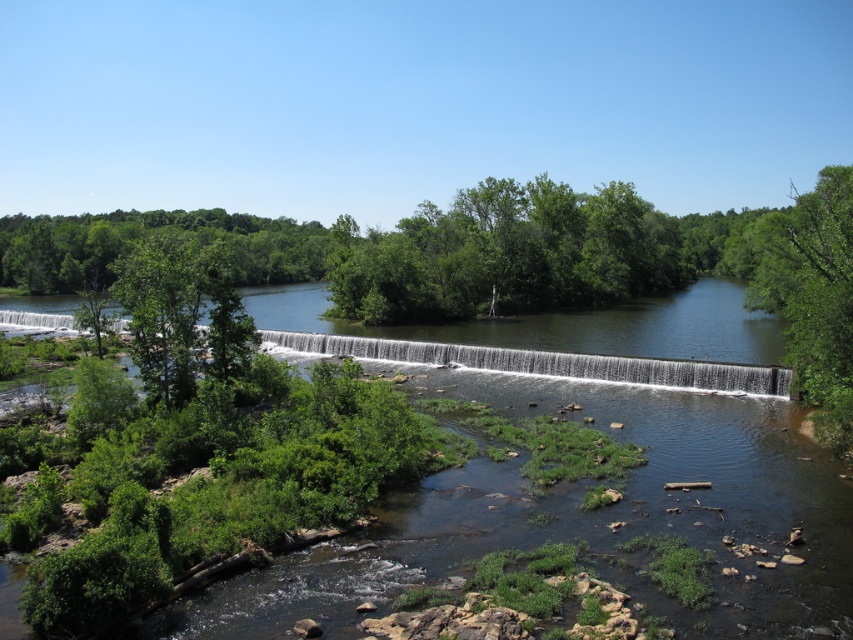
Is green leafy trees at upper left behind smooth concrete dam at center?

No, green leafy trees at upper left is in front of smooth concrete dam at center.

Which is above, green leafy trees at upper left or smooth concrete dam at center?

green leafy trees at upper left is above.

In order to click on green leafy trees at upper left in this screenshot , I will do `click(146, 234)`.

Is the position of green leafy tree at right more distant than that of smooth concrete dam at center?

No, green leafy tree at right is in front of smooth concrete dam at center.

Consider the image. Which of these two, green leafy tree at right or smooth concrete dam at center, stands shorter?

smooth concrete dam at center

Is point (848, 352) less distant than point (598, 378)?

Yes, it is.

In order to click on green leafy tree at right in this screenshot , I will do `click(811, 298)`.

Can you confirm if green leafy tree at right is shorter than green leafy trees at upper left?

In fact, green leafy tree at right may be taller than green leafy trees at upper left.

Can you confirm if green leafy tree at right is taller than green leafy trees at upper left?

Indeed, green leafy tree at right has a greater height compared to green leafy trees at upper left.

Where is `green leafy tree at right`? The image size is (853, 640). green leafy tree at right is located at coordinates (811, 298).

The height and width of the screenshot is (640, 853). In order to click on green leafy tree at right in this screenshot , I will do `click(811, 298)`.